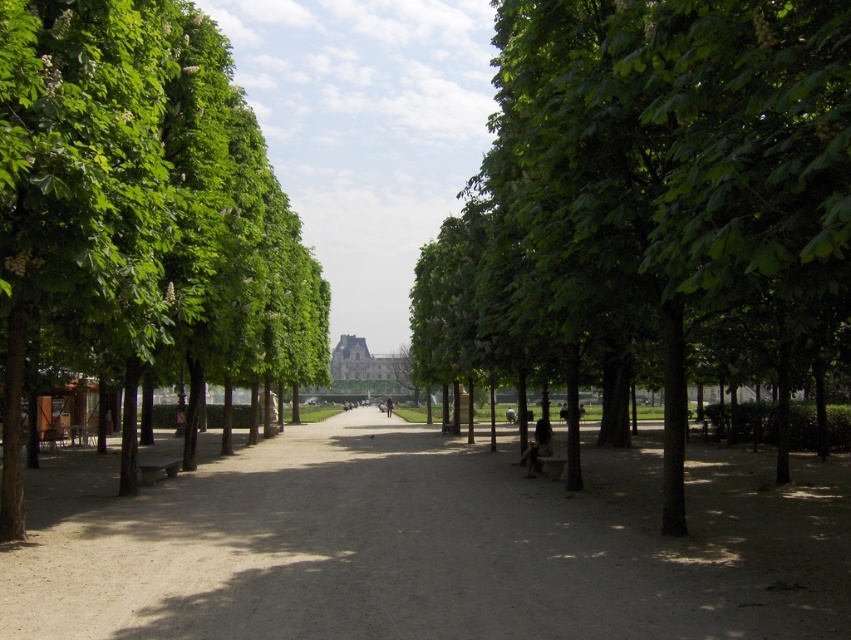
You are a gardener planning to plant a new row of flowers along the dirt path at center and green leafy tree at center. Given their widths, which one would require more space for the flower bed?

The dirt path at center requires more space for the flower bed because its width surpasses that of the green leafy tree at center.

You are standing at the edge of the park pathway and want to reach the large ornate building in the background. There is a green leafy tree at center blocking your direct path. Can you walk around it without leaving the pathway? Please explain your reasoning.

The green leafy tree at center is 4.33 meters away from the viewer. Since the pathway is wide and flanked by evenly spaced trees, there is likely enough space to walk around the tree while staying on the pathway. However, the exact feasibility depends on the tree trunk width and the pathway width, which are not specified here.